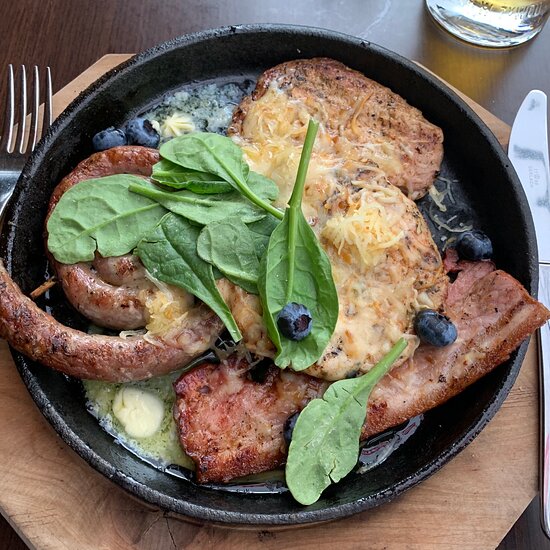
The height and width of the screenshot is (550, 550). What are the coordinates of `table` in the screenshot? It's located at (500, 86).